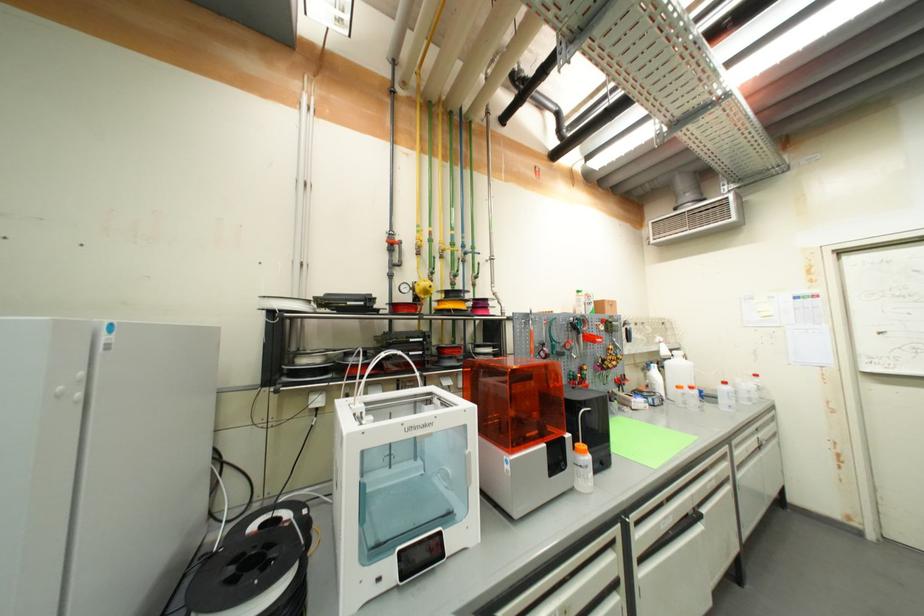
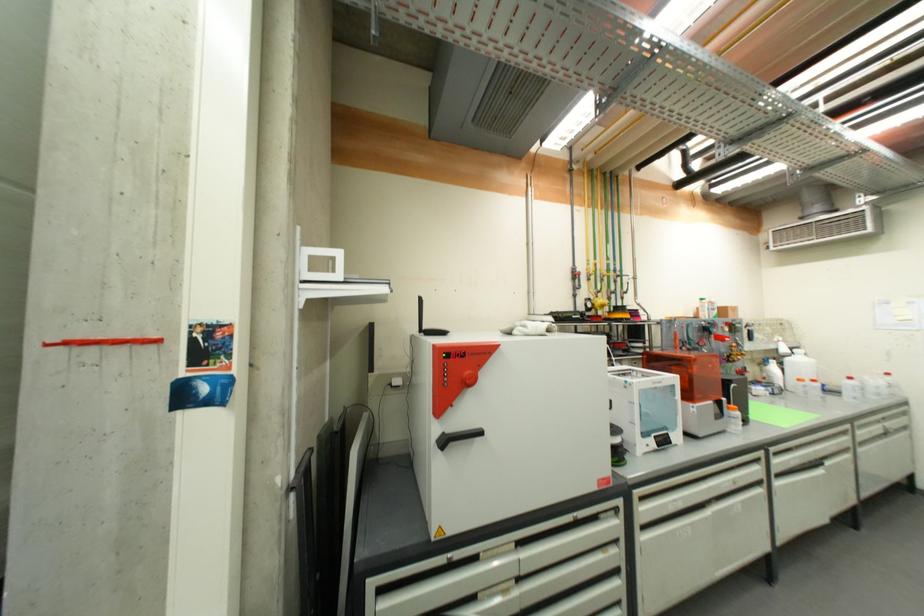
Locate, in the second image, the point that corresponds to (x=657, y=385) in the first image.

(774, 378)